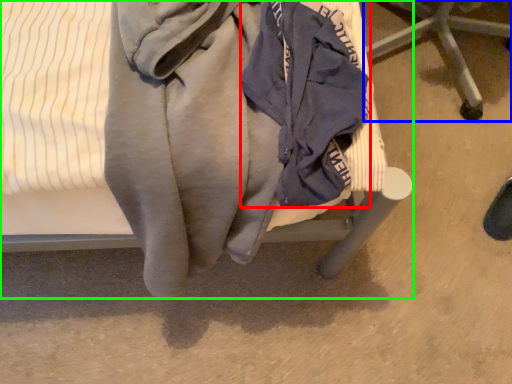
Question: Which object is positioned farthest from garment (highlighted by a red box)? Select from furniture (highlighted by a blue box) and furniture (highlighted by a green box).

Choices:
 (A) furniture
 (B) furniture

Answer: (A)